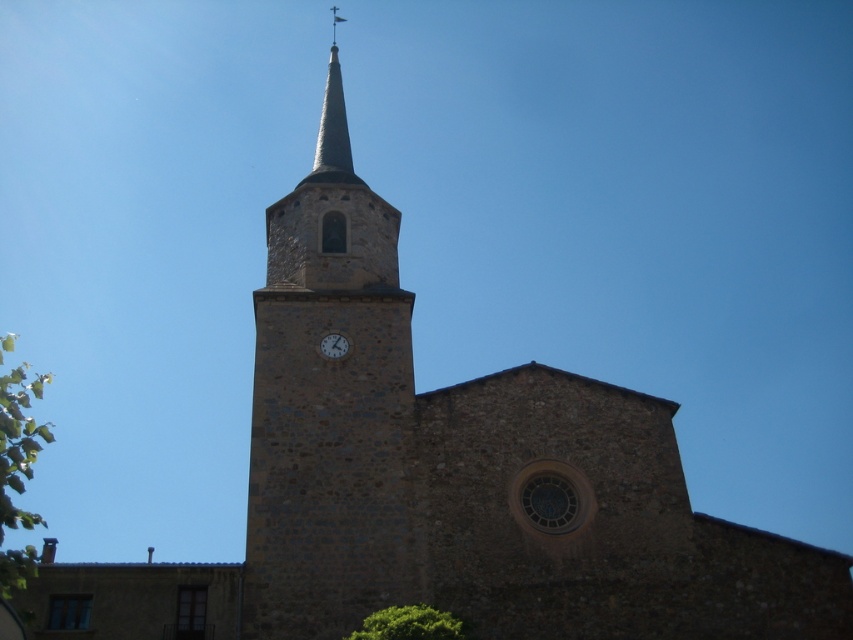
Question: From the image, what is the correct spatial relationship of stone clock tower at center in relation to smooth gray steeple at upper center?

Choices:
 (A) below
 (B) above

Answer: (A)

Question: From the image, what is the correct spatial relationship of stone clock tower at center in relation to matte stone clock at center?

Choices:
 (A) below
 (B) above

Answer: (B)

Question: Does stone clock tower at center have a larger size compared to matte stone clock at center?

Choices:
 (A) no
 (B) yes

Answer: (B)

Question: Which object is farther from the camera taking this photo?

Choices:
 (A) green leafy tree at lower left
 (B) matte stone clock at center
 (C) stone clock tower at center

Answer: (B)

Question: Which object is farther from the camera taking this photo?

Choices:
 (A) green leafy tree at lower left
 (B) green leafy tree at lower center

Answer: (B)

Question: Which is nearer to the smooth gray steeple at upper center?

Choices:
 (A) green leafy tree at lower center
 (B) green leafy tree at lower left
 (C) matte stone clock at center
 (D) stone clock tower at center

Answer: (D)